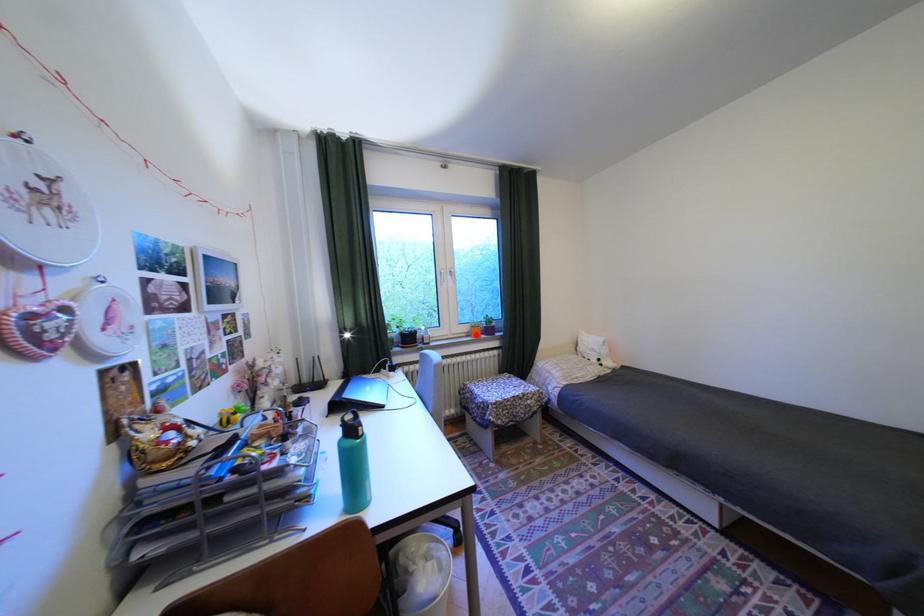
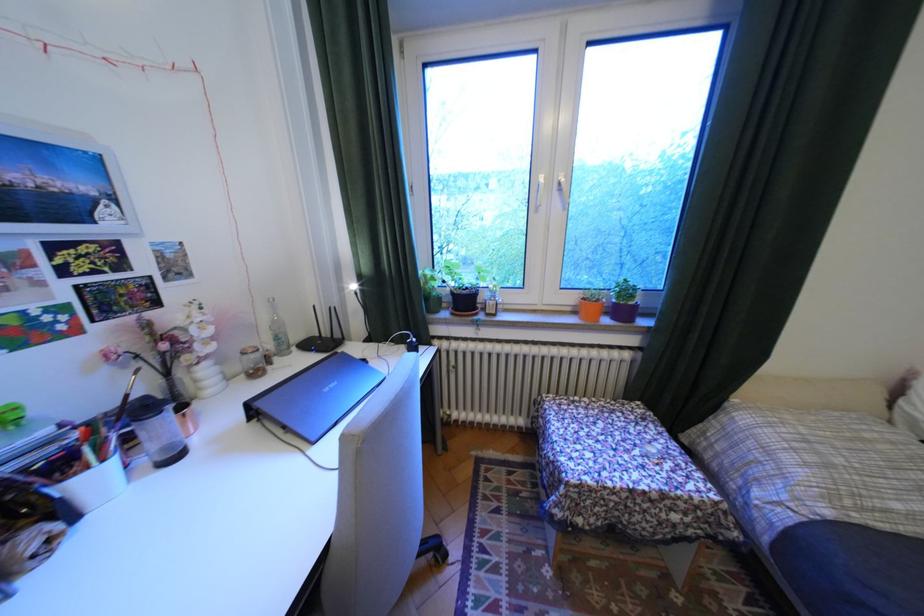
Where in the second image is the point corresponding to the highlighted location from the first image?

(580, 309)